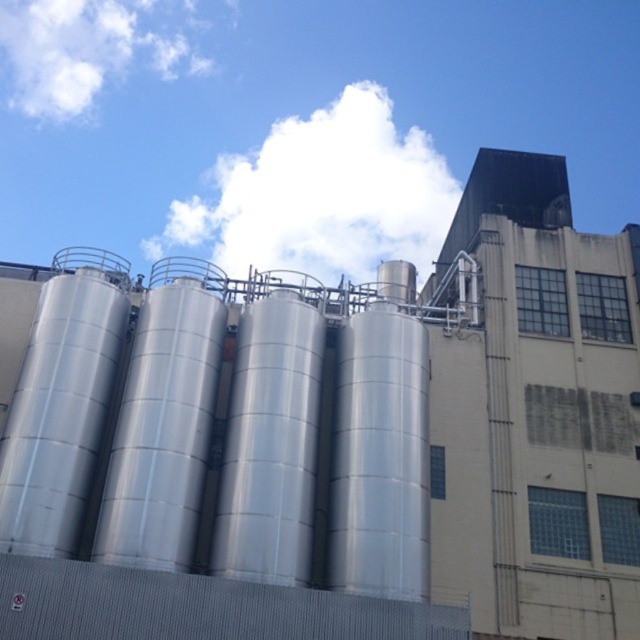
You are an engineer inspecting the industrial site from above. There is a white fluffy cloud at upper center located at point [321,195]. Can you confirm if this cloud is positioned above the beige building to the right of the silos?

The white fluffy cloud at upper center is located at point [321,195], which is above the beige building to the right of the silos.

Looking at the industrial scene with the four silos and the beige building, you notice two white fluffy clouds in the sky. Which of the two clouds, the white fluffy cloud at upper center or the white fluffy cloud at upper left, has a smaller height?

The white fluffy cloud at upper center is shorter than the white fluffy cloud at upper left, so the one at upper center has a smaller height.